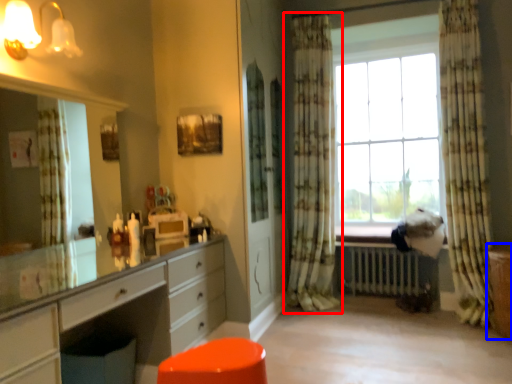
Question: Among these objects, which one is farthest to the camera, curtain (highlighted by a red box) or file cabinet (highlighted by a blue box)?

Choices:
 (A) curtain
 (B) file cabinet

Answer: (A)